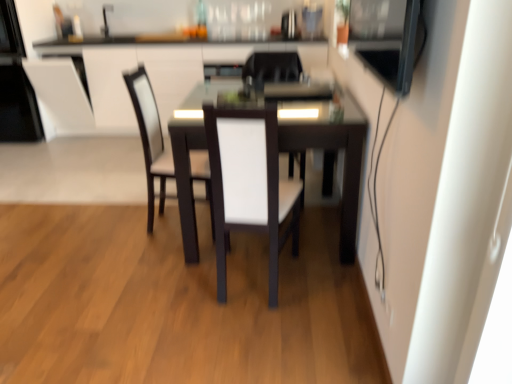
This screenshot has height=384, width=512. In order to click on vacant space in front of white fabric chair at center, which is the 3th chair from back to front in this screenshot , I will do `click(253, 333)`.